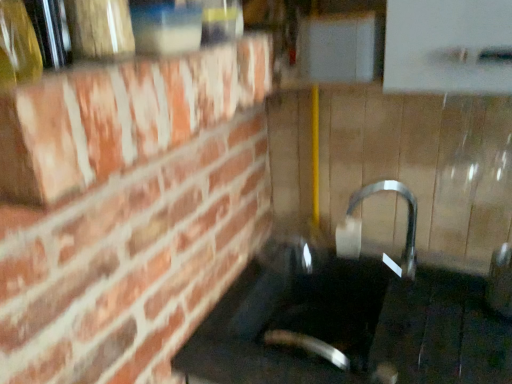
Locate an element on the screen. free spot above black glass sink at center (from a real-world perspective) is located at coordinates (404, 327).